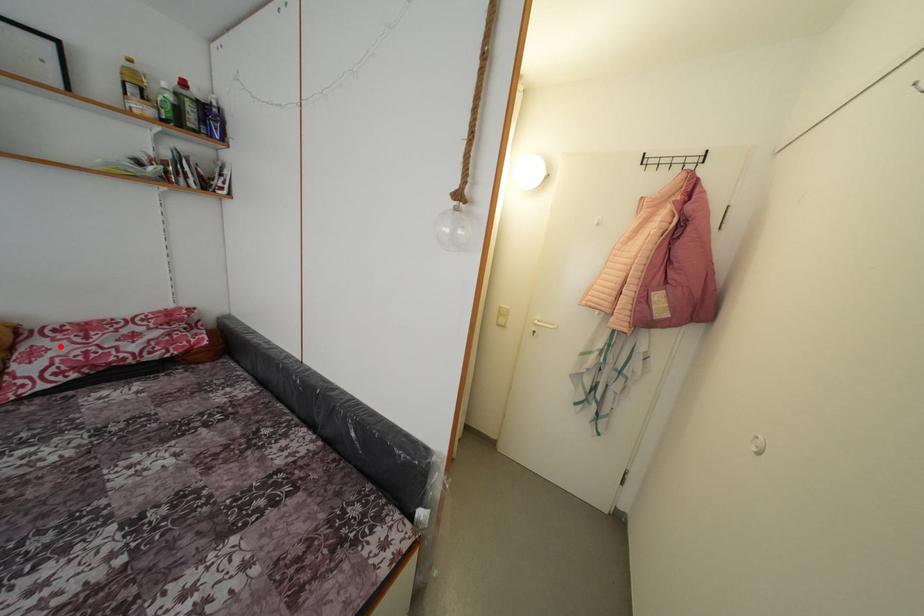
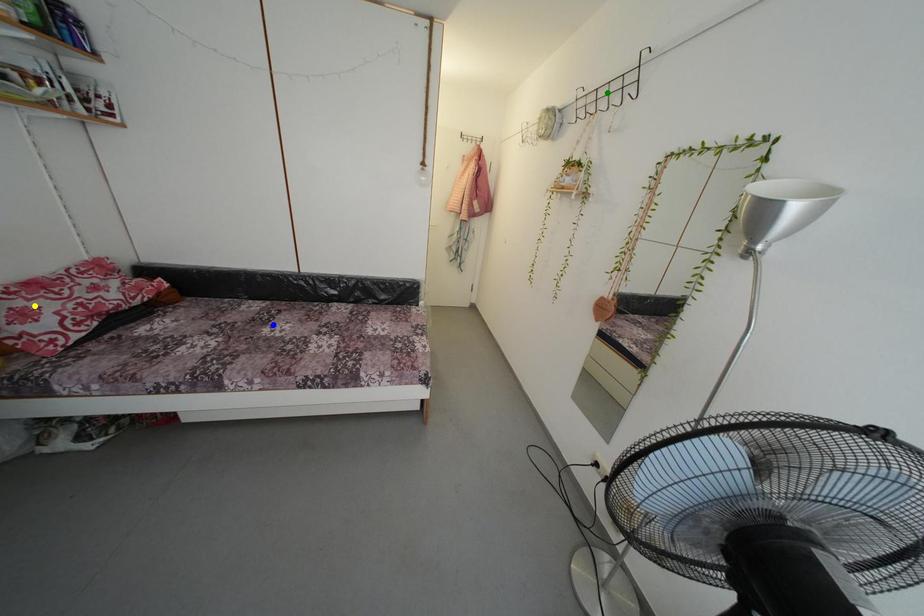
Question: I am providing you with two images of the same scene from different viewpoints. A red point is marked on the first image. You are given multiple points on the second image. Which spot in image 2 lines up with the point in image 1?

Choices:
 (A) blue point
 (B) green point
 (C) yellow point

Answer: (C)